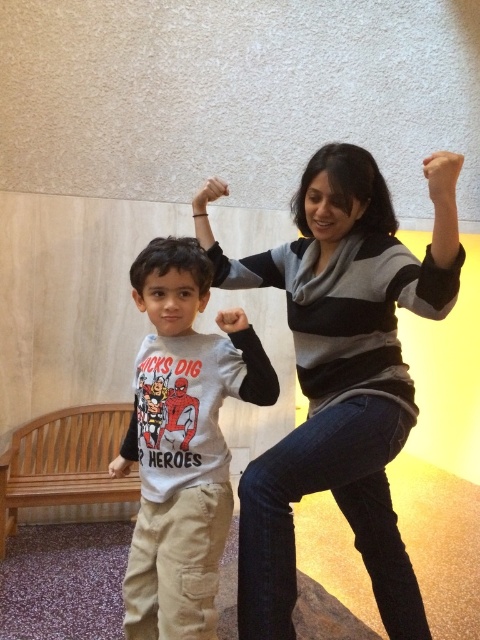
Looking at this image, is matte black sleeve at upper center shorter than matte black fist at upper center?

No.

Which is more to the left, matte black sleeve at upper center or matte black fist at upper center?

From the viewer's perspective, matte black fist at upper center appears more on the left side.

Between point (264, 387) and point (202, 211), which one is positioned behind?

The point (202, 211) is behind.

In order to click on matte black sleeve at upper center in this screenshot , I will do `click(251, 358)`.

Is matte black sleeve at upper center above matte black hand at upper center?

No.

Between matte black sleeve at upper center and matte black hand at upper center, which one has more height?

Standing taller between the two is matte black sleeve at upper center.

Is point (226, 326) positioned in front of point (455, 198)?

No, it is behind (455, 198).

Find the location of a particular element. The image size is (480, 640). matte black sleeve at upper center is located at coordinates (251, 358).

Is matte black arm at upper center closer to the viewer compared to matte black fist at upper center?

That is True.

Does matte black arm at upper center appear over matte black fist at upper center?

Incorrect, matte black arm at upper center is not positioned above matte black fist at upper center.

Between point (236, 266) and point (196, 204), which one is positioned behind?

The point (236, 266) is behind.

You are a GUI agent. You are given a task and a screenshot of the screen. Output one action in this format:
    pyautogui.click(x=<x>, y=<y>)
    Task: Click on the matte black arm at upper center
    The width and height of the screenshot is (480, 640).
    Given the screenshot: What is the action you would take?
    pyautogui.click(x=226, y=256)